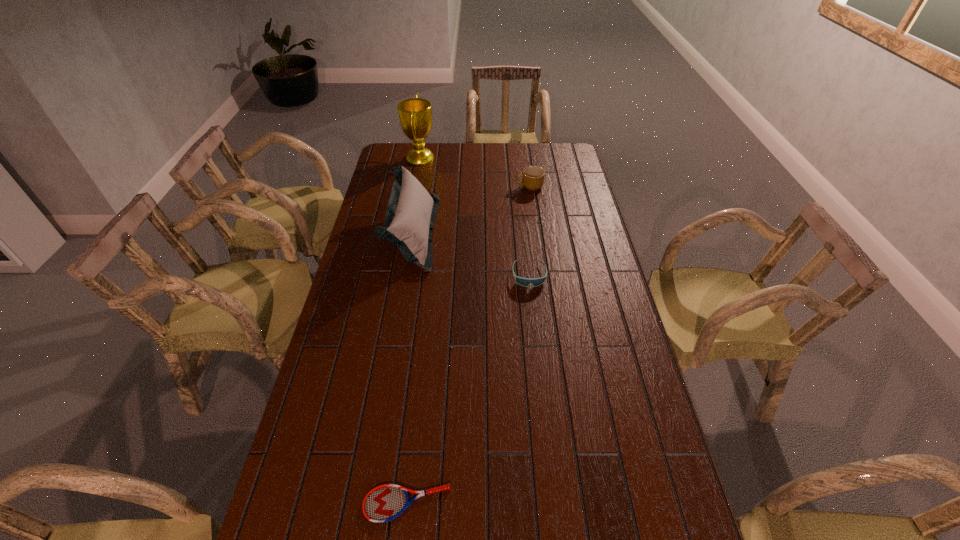
Locate an element on the screen. The width and height of the screenshot is (960, 540). the tallest object is located at coordinates (415, 114).

Identify the location of the farthest object. (415, 114).

Locate an element on the screen. cushion is located at coordinates (411, 211).

This screenshot has height=540, width=960. I want to click on mug, so click(x=533, y=177).

You are a GUI agent. You are given a task and a screenshot of the screen. Output one action in this format:
    pyautogui.click(x=<x>, y=<y>)
    Task: Click on the fourth nearest object
    Image resolution: width=960 pixels, height=540 pixels.
    Given the screenshot: What is the action you would take?
    pyautogui.click(x=533, y=177)

Identify the location of the fourth tallest object. The image size is (960, 540). (525, 282).

Find the location of a particular element. the nearest object is located at coordinates (384, 503).

Identify the location of tennis racket. Image resolution: width=960 pixels, height=540 pixels. (384, 503).

Locate an element on the screen. vacant space situated 0.350m on the shiny surface of the award is located at coordinates (508, 158).

Where is `free space located on the surface of the cushion`? This screenshot has width=960, height=540. free space located on the surface of the cushion is located at coordinates (475, 233).